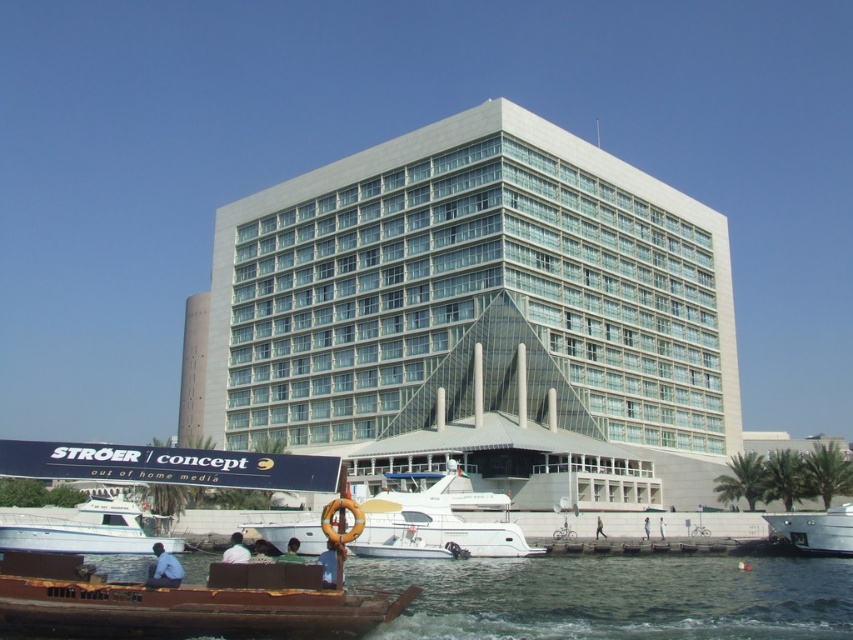
Is point (305, 547) more distant than point (660, 524)?

No, it is not.

Locate an element on the screen. white glossy boat at center is located at coordinates (439, 525).

Between white glass building at center and brown wooden boat at lower left, which one is positioned lower?

Positioned lower is brown wooden boat at lower left.

Does white glass building at center have a greater width compared to brown wooden boat at lower left?

Yes, white glass building at center is wider than brown wooden boat at lower left.

At what (x,y) coordinates should I click in order to perform the action: click on white glass building at center. Please return your answer as a coordinate pair (x, y). Looking at the image, I should click on (476, 317).

In the scene shown: Who is higher up, light blue shirt at lower left or light blue shirt at lower center?

light blue shirt at lower left is higher up.

Does light blue shirt at lower left lie behind light blue shirt at lower center?

No.

Describe the element at coordinates (164, 568) in the screenshot. I see `light blue shirt at lower left` at that location.

In order to click on light blue shirt at lower left in this screenshot , I will do `click(164, 568)`.